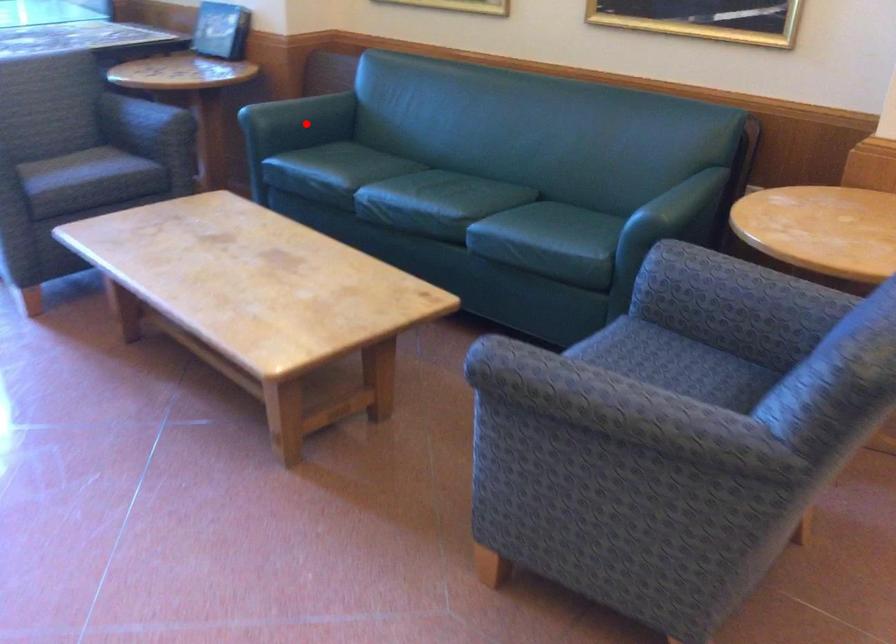
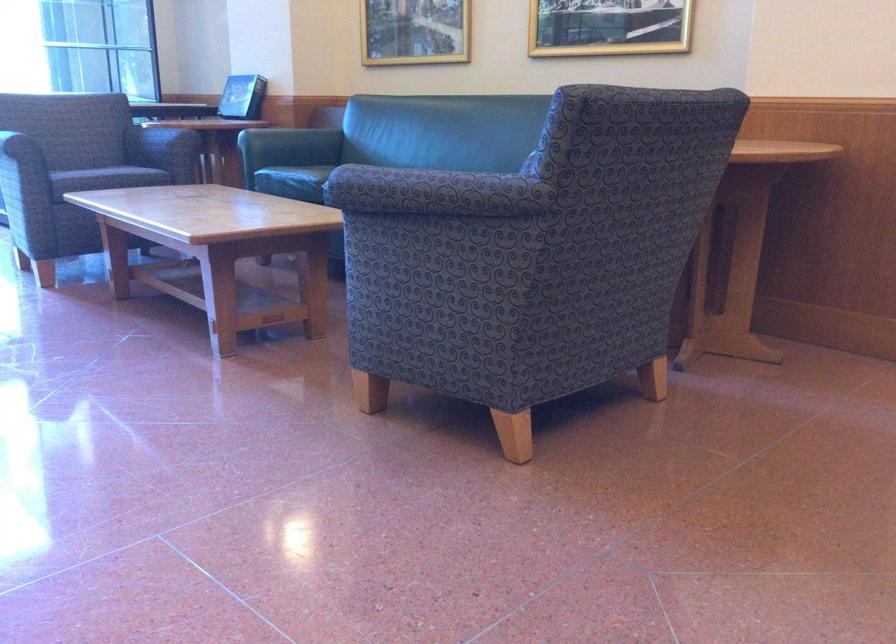
Question: I am providing you with two images of the same scene from different viewpoints. Image1 has a red point marked. In image2, the corresponding 3D location appears at what relative position? Reply with the corresponding letter.

Choices:
 (A) Closer
 (B) Farther

Answer: (B)